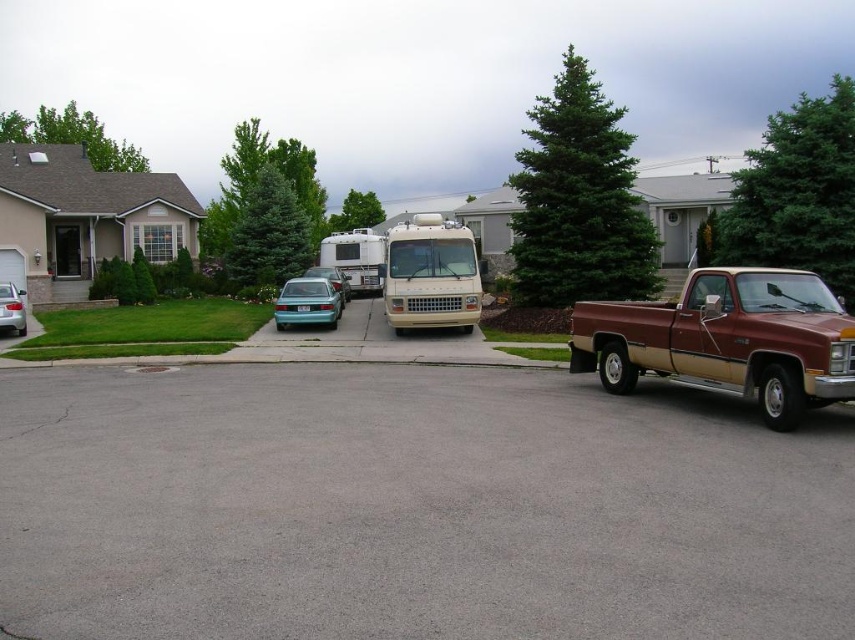
Based on the photo, you are a delivery driver who needs to back up your vehicle from the beige matte rv at center to the teal glossy sedan at lower left. Can you safely maneuver around them without hitting either?

The beige matte rv at center is to the right of the teal glossy sedan at lower left, so you can safely maneuver around them by moving to the left side of the teal glossy sedan at lower left and backing up towards the beige matte rv at center without collision.

You are standing at the point labeled point [337,268] and want to walk to the point labeled point [3,301]. Which direction should you move relative to the scene?

You should move towards the viewer because point [3,301] is closer to the viewer than point [337,268].